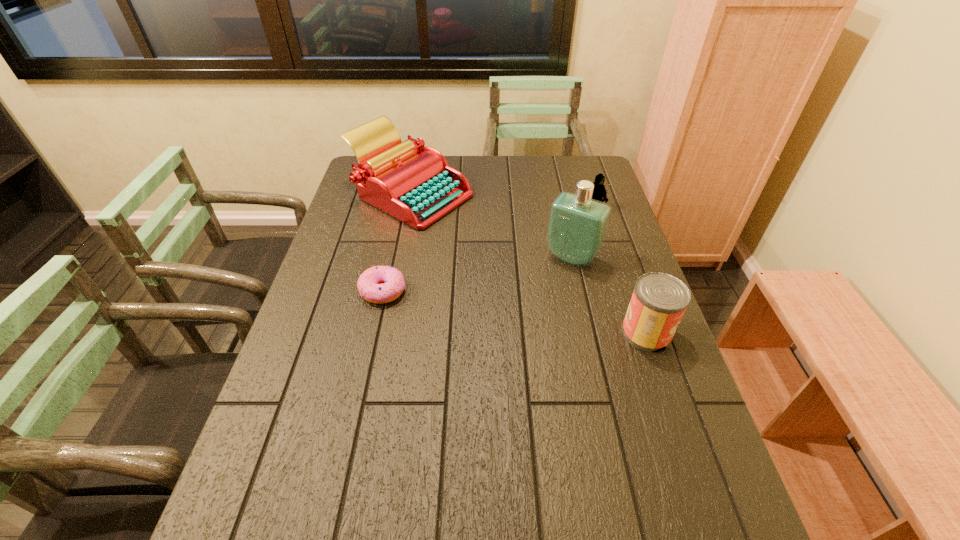
Identify the location of the fourth farthest object. (369, 287).

In order to click on the shortest object in this screenshot , I will do pyautogui.click(x=369, y=287).

This screenshot has height=540, width=960. What are the coordinates of `can` in the screenshot? It's located at (659, 300).

Find the location of a particular element. the third tallest object is located at coordinates (659, 300).

The width and height of the screenshot is (960, 540). Find the location of `perfume`. perfume is located at coordinates (577, 227).

Identify the location of the third nearest object. (577, 227).

This screenshot has width=960, height=540. What are the coordinates of `Lego` in the screenshot? It's located at (599, 193).

Locate an element on the screen. Image resolution: width=960 pixels, height=540 pixels. the second tallest object is located at coordinates (413, 183).

Find the location of a particular element. This screenshot has height=540, width=960. blank space located on the back of the shortest object is located at coordinates (394, 244).

This screenshot has height=540, width=960. I want to click on vacant space located on the left of the can, so click(566, 333).